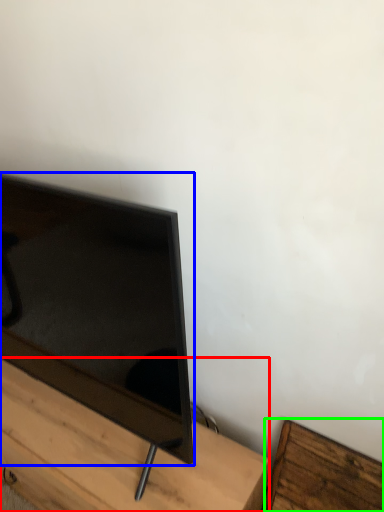
Question: Which object is the farthest from furniture (highlighted by a red box)? Choose among these: television (highlighted by a blue box) or furniture (highlighted by a green box).

Choices:
 (A) television
 (B) furniture

Answer: (B)